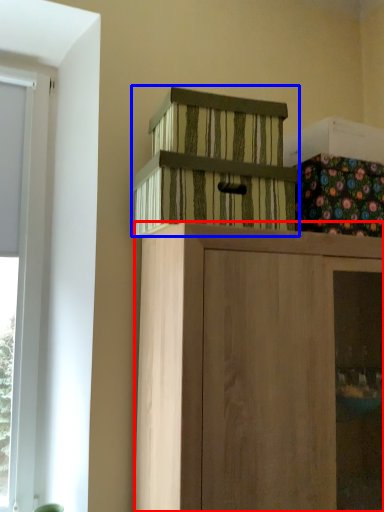
Question: Which object is closer to the camera taking this photo, cabinetry (highlighted by a red box) or cabinetry (highlighted by a blue box)?

Choices:
 (A) cabinetry
 (B) cabinetry

Answer: (A)